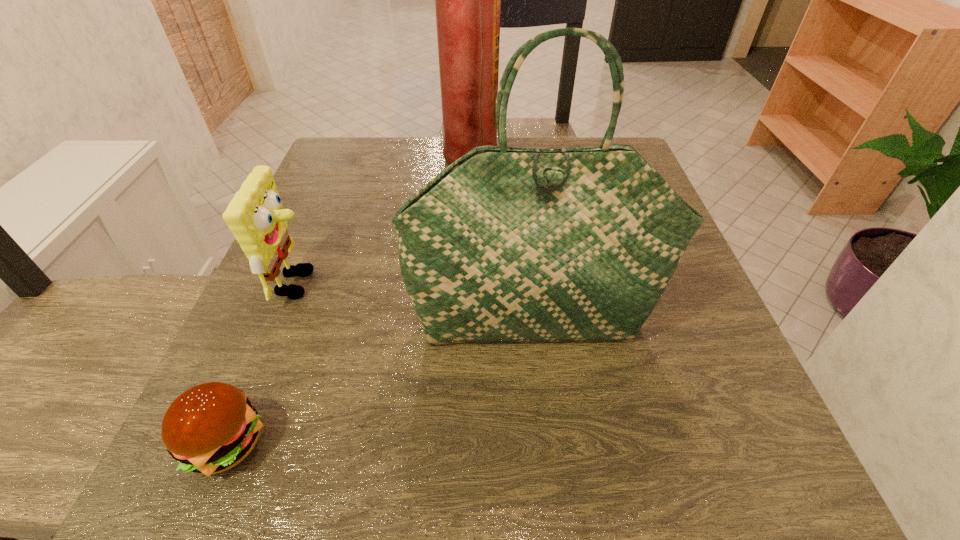
Find the location of a particular element. vacant space in between the third tallest object and the shortest object is located at coordinates [x=263, y=363].

At what (x,y) coordinates should I click in order to perform the action: click on free spot between the fire extinguisher and the nearest object. Please return your answer as a coordinate pair (x, y). Looking at the image, I should click on pyautogui.click(x=347, y=303).

Find the location of a particular element. The width and height of the screenshot is (960, 540). free area in between the nearest object and the second shortest object is located at coordinates (263, 363).

Locate an element on the screen. The width and height of the screenshot is (960, 540). blank region between the sponge and the fire extinguisher is located at coordinates (383, 222).

Identify the location of empty space between the farthest object and the shortest object. This screenshot has height=540, width=960. 347,303.

Locate an element on the screen. Image resolution: width=960 pixels, height=540 pixels. the closest object to the tote bag is located at coordinates (255, 215).

Select which object is the second closest to the fire extinguisher. Please provide its 2D coordinates. Your answer should be formatted as a tuple, i.e. [(x, y)], where the tuple contains the x and y coordinates of a point satisfying the conditions above.

[(506, 245)]

Identify the location of vacant space that satisfies the following two spatial constraints: 1. on the side of the fire extinguisher with the label; 2. on the right side of the tote bag. (461, 322).

Locate an element on the screen. This screenshot has width=960, height=540. free spot that satisfies the following two spatial constraints: 1. on the face of the tote bag; 2. on the left side of the third tallest object is located at coordinates (284, 322).

Locate an element on the screen. The image size is (960, 540). free space that satisfies the following two spatial constraints: 1. on the back side of the tote bag; 2. on the side of the fire extinguisher with the label is located at coordinates click(x=516, y=162).